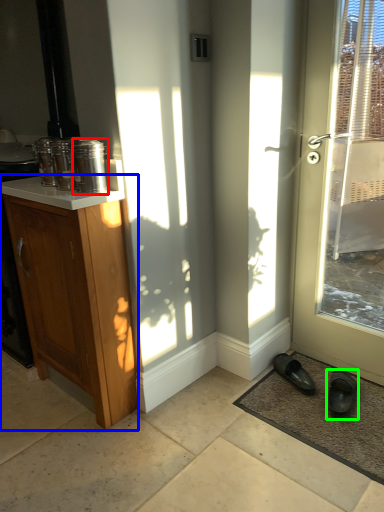
Question: Which object is the closest to the glass jar (highlighted by a red box)? Choose among these: cabinetry (highlighted by a blue box) or footwear (highlighted by a green box).

Choices:
 (A) cabinetry
 (B) footwear

Answer: (A)